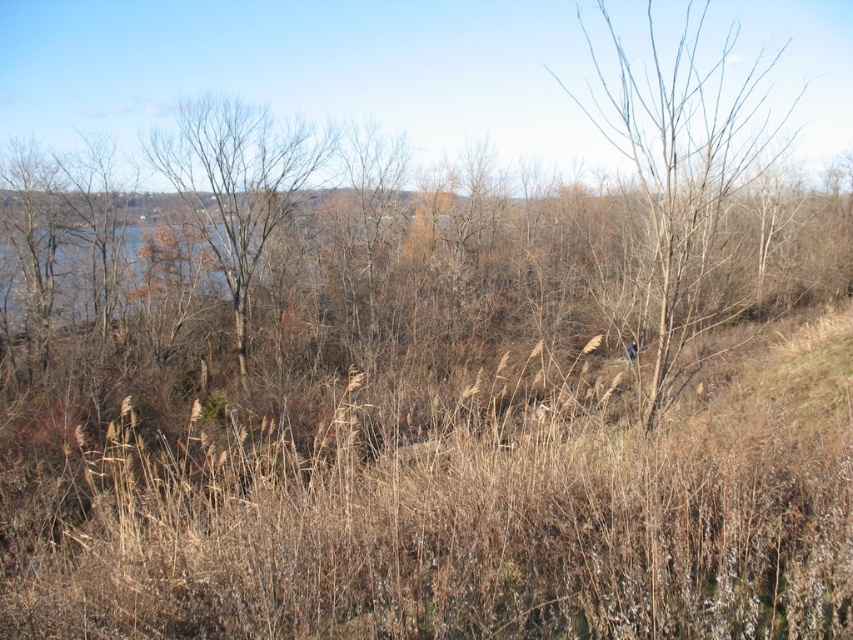
You are an ornithologist observing birds in the natural landscape. You notice two clusters of bare branches at center and bare branches at left. Which cluster of branches would likely provide a better vantage point for a bird to spot potential predators?

The bare branches at center has a larger size compared to bare branches at left, so it would provide a better vantage point for a bird to spot potential predators because its larger size offers a higher and more elevated position.

You are standing in the natural landscape scene described. There is a point marked at coordinates (685, 164). What object in the scene corresponds to this point?

The point at coordinates (685, 164) corresponds to the bare branches at center.